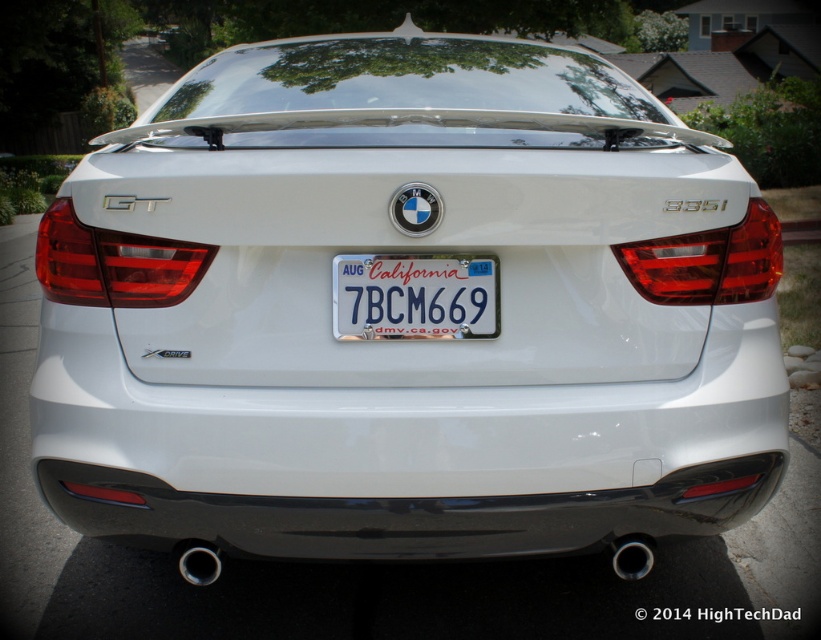
You are a car designer evaluating the rear design of the white BMW 335i GT. Based on the provided image, which object has a smaller width between the white metallic license plate at center and the matte red tail light at right?

The white metallic license plate at center has a smaller width compared to the matte red tail light at right, as stated in the description that the license plate at center is less than the tail light at right in width.

What are the coordinates of the white metallic license plate at center?

The white metallic license plate at center is located at point (x=414, y=296).